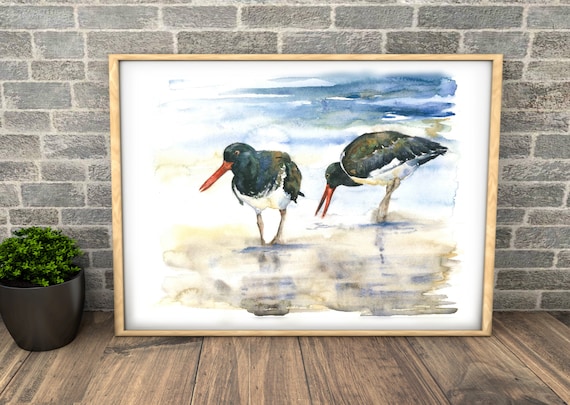
I want to click on gray stone wall, so click(x=549, y=178), click(x=48, y=134).